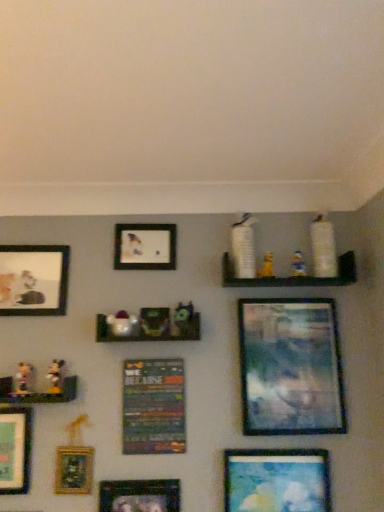
Question: Is the depth of matte blue painting at lower right, acting as the 7th picture frame starting from the left, greater than that of matte green picture frame at lower left, the first picture frame positioned from the left?

Choices:
 (A) yes
 (B) no

Answer: (B)

Question: Would you say matte green picture frame at lower left, the first picture frame positioned from the left, is part of matte blue painting at lower right, acting as the 7th picture frame starting from the left,'s contents?

Choices:
 (A) yes
 (B) no

Answer: (B)

Question: From the image's perspective, is matte blue painting at lower right, arranged as the 2th picture frame when viewed from the right, on matte green picture frame at lower left, the 8th picture frame from the right?

Choices:
 (A) no
 (B) yes

Answer: (A)

Question: Can you confirm if matte blue painting at lower right, acting as the 7th picture frame starting from the left, is bigger than matte green picture frame at lower left, the 8th picture frame from the right?

Choices:
 (A) no
 (B) yes

Answer: (B)

Question: Is matte blue painting at lower right, acting as the 7th picture frame starting from the left, positioned far away from matte green picture frame at lower left, the first picture frame positioned from the left?

Choices:
 (A) no
 (B) yes

Answer: (A)

Question: Based on their sizes in the image, would you say matte plastic shelf at center, which is counted as the 2th shelf, starting from the right, is bigger or smaller than metallic silver picture frame at lower center, which is the fourth picture frame from left to right?

Choices:
 (A) small
 (B) big

Answer: (B)

Question: Based on their positions, is matte plastic shelf at center, the second shelf positioned from the bottom, located to the left or right of metallic silver picture frame at lower center, which ranks as the 5th picture frame in right-to-left order?

Choices:
 (A) right
 (B) left

Answer: (A)

Question: From their relative heights in the image, would you say matte plastic shelf at center, the second shelf positioned from the bottom, is taller or shorter than metallic silver picture frame at lower center, which ranks as the 5th picture frame in right-to-left order?

Choices:
 (A) short
 (B) tall

Answer: (A)

Question: Is point (112, 336) closer or farther from the camera than point (99, 494)?

Choices:
 (A) closer
 (B) farther

Answer: (B)

Question: Visually, is matte green picture frame at lower left, the 8th picture frame from the right, positioned to the left or to the right of matte blue painting at lower right, acting as the 7th picture frame starting from the left?

Choices:
 (A) left
 (B) right

Answer: (A)

Question: Is point (1, 418) closer or farther from the camera than point (314, 456)?

Choices:
 (A) closer
 (B) farther

Answer: (B)

Question: Is matte green picture frame at lower left, the first picture frame positioned from the left, wider or thinner than matte blue painting at lower right, arranged as the 2th picture frame when viewed from the right?

Choices:
 (A) thin
 (B) wide

Answer: (A)

Question: From a real-world perspective, is matte green picture frame at lower left, the first picture frame positioned from the left, positioned above or below matte blue painting at lower right, acting as the 7th picture frame starting from the left?

Choices:
 (A) below
 (B) above

Answer: (B)

Question: From their relative heights in the image, would you say metallic silver picture frame at lower center, which ranks as the 5th picture frame in right-to-left order, is taller or shorter than gold-framed painting at lower left, which appears as the third picture frame when viewed from the left?

Choices:
 (A) short
 (B) tall

Answer: (A)

Question: From the image's perspective, is metallic silver picture frame at lower center, which ranks as the 5th picture frame in right-to-left order, above or below gold-framed painting at lower left, the 6th picture frame from the right?

Choices:
 (A) below
 (B) above

Answer: (A)